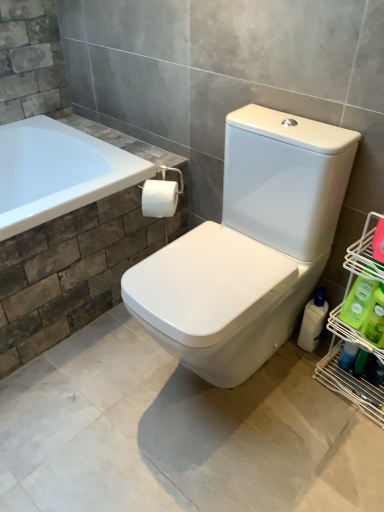
Question: Considering the relative sizes of green plastic bottle at right, marked as the 2th cleaning product in a back-to-front arrangement, and green plastic bottle at lower right, placed as the first cleaning product when sorted from front to back, in the image provided, is green plastic bottle at right, marked as the 2th cleaning product in a back-to-front arrangement, wider than green plastic bottle at lower right, placed as the first cleaning product when sorted from front to back,?

Choices:
 (A) no
 (B) yes

Answer: (A)

Question: Considering the relative sizes of green plastic bottle at right, marked as the 2th cleaning product in a back-to-front arrangement, and green plastic bottle at lower right, placed as the first cleaning product when sorted from front to back, in the image provided, is green plastic bottle at right, marked as the 2th cleaning product in a back-to-front arrangement, taller than green plastic bottle at lower right, placed as the first cleaning product when sorted from front to back,?

Choices:
 (A) no
 (B) yes

Answer: (A)

Question: Is green plastic bottle at right, which is the second cleaning product from front to back, smaller than green plastic bottle at lower right, placed as the first cleaning product when sorted from front to back?

Choices:
 (A) no
 (B) yes

Answer: (B)

Question: Is green plastic bottle at right, which is the second cleaning product from front to back, positioned in front of green plastic bottle at lower right, placed as the first cleaning product when sorted from front to back?

Choices:
 (A) no
 (B) yes

Answer: (A)

Question: Is green plastic bottle at right, which is the second cleaning product from front to back, to the left of green plastic bottle at lower right, placed as the first cleaning product when sorted from front to back, from the viewer's perspective?

Choices:
 (A) no
 (B) yes

Answer: (B)

Question: Does green plastic bottle at right, which is the second cleaning product from front to back, have a lesser width compared to green plastic bottle at lower right, which is counted as the third cleaning product, starting from the back?

Choices:
 (A) no
 (B) yes

Answer: (B)

Question: Does green plastic bottle at right, marked as the 2th cleaning product in a back-to-front arrangement, touch white matte toilet paper at center?

Choices:
 (A) no
 (B) yes

Answer: (A)

Question: Considering the relative sizes of green plastic bottle at right, marked as the 2th cleaning product in a back-to-front arrangement, and white matte toilet paper at center in the image provided, is green plastic bottle at right, marked as the 2th cleaning product in a back-to-front arrangement, thinner than white matte toilet paper at center?

Choices:
 (A) yes
 (B) no

Answer: (A)

Question: Does green plastic bottle at right, which is the second cleaning product from front to back, come behind white matte toilet paper at center?

Choices:
 (A) yes
 (B) no

Answer: (B)

Question: Would you say green plastic bottle at right, marked as the 2th cleaning product in a back-to-front arrangement, contains white matte toilet paper at center?

Choices:
 (A) yes
 (B) no

Answer: (B)

Question: Can you confirm if green plastic bottle at right, marked as the 2th cleaning product in a back-to-front arrangement, is smaller than white matte toilet paper at center?

Choices:
 (A) yes
 (B) no

Answer: (A)

Question: Is white matte toilet paper at center positioned far away from white glossy bottle at lower right, marked as the 1th cleaning product in a back-to-front arrangement?

Choices:
 (A) no
 (B) yes

Answer: (A)